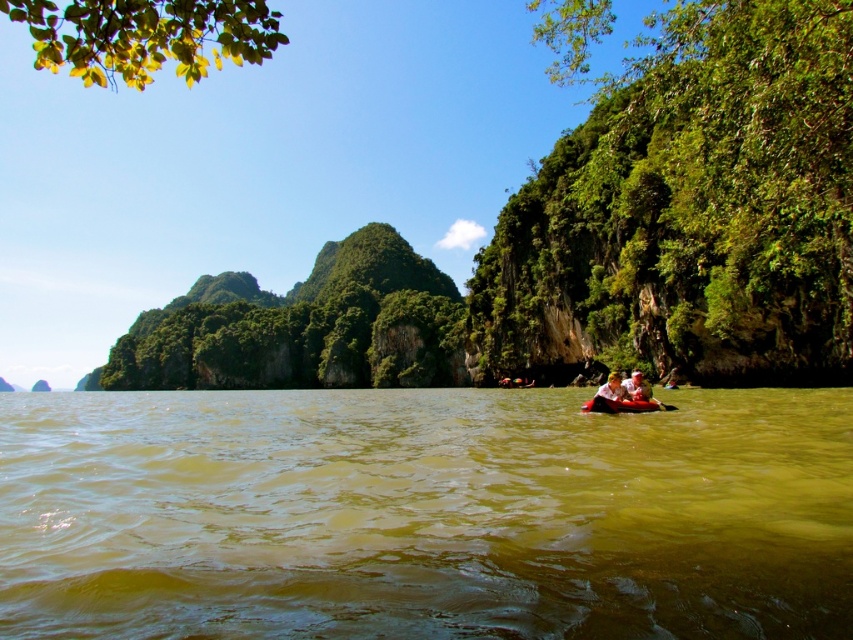
Question: Is brown murky water at center closer to camera compared to smooth red kayak at center?

Choices:
 (A) no
 (B) yes

Answer: (B)

Question: Which object is positioned closest to the smooth red kayak at center?

Choices:
 (A) white cotton shirt at lower right
 (B) brown murky water at center

Answer: (A)

Question: Observing the image, what is the correct spatial positioning of brown murky water at center in reference to white cotton shirt at lower right?

Choices:
 (A) below
 (B) above

Answer: (A)

Question: Which of the following is the closest to the observer?

Choices:
 (A) (614, 394)
 (B) (634, 444)

Answer: (B)

Question: Estimate the real-world distances between objects in this image. Which object is closer to the brown murky water at center?

Choices:
 (A) white cotton shirt at lower right
 (B) smooth red kayak at center

Answer: (B)

Question: Is white cotton shirt at lower right wider than smooth red kayak at center?

Choices:
 (A) yes
 (B) no

Answer: (B)